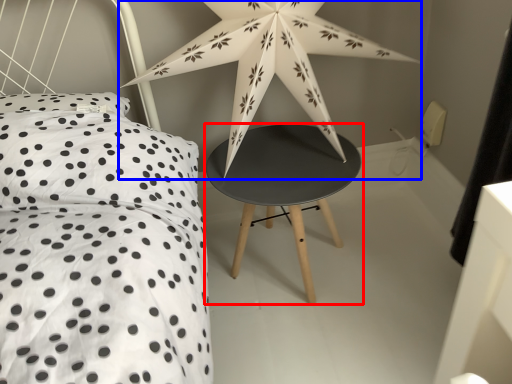
Question: Which object appears closest to the camera in this image, stool (highlighted by a red box) or star (highlighted by a blue box)?

Choices:
 (A) stool
 (B) star

Answer: (B)